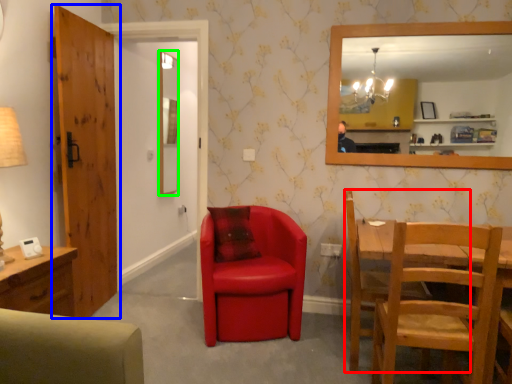
Question: Estimate the real-world distances between objects in this image. Which object is farther from chair (highlighted by a red box), door (highlighted by a blue box) or mirror (highlighted by a green box)?

Choices:
 (A) door
 (B) mirror

Answer: (B)